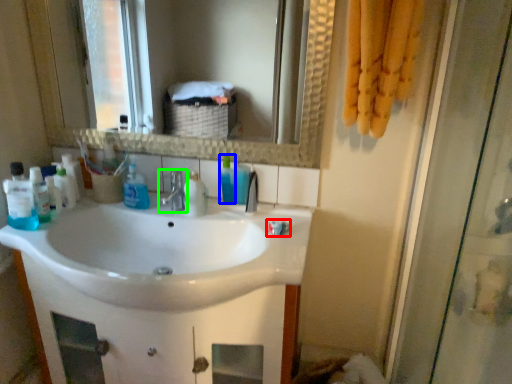
Question: Based on their relative distances, which object is nearer to toothpaste (highlighted by a red box)? Choose from cleaning product (highlighted by a blue box) and tap (highlighted by a green box).

Choices:
 (A) cleaning product
 (B) tap

Answer: (A)